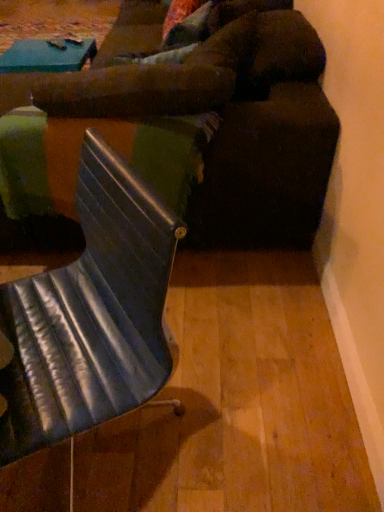
Question: Considering the relative sizes of metallic blue chair at center and metallic silver table at center in the image provided, is metallic blue chair at center bigger than metallic silver table at center?

Choices:
 (A) yes
 (B) no

Answer: (A)

Question: From the image's perspective, is metallic blue chair at center over metallic silver table at center?

Choices:
 (A) yes
 (B) no

Answer: (B)

Question: Does metallic blue chair at center appear on the left side of metallic silver table at center?

Choices:
 (A) no
 (B) yes

Answer: (A)

Question: From a real-world perspective, is metallic blue chair at center positioned over metallic silver table at center based on gravity?

Choices:
 (A) no
 (B) yes

Answer: (B)

Question: Does metallic blue chair at center have a lesser width compared to metallic silver table at center?

Choices:
 (A) no
 (B) yes

Answer: (B)

Question: From a real-world perspective, relative to metallic blue chair at center, is metallic silver table at center vertically above or below?

Choices:
 (A) below
 (B) above

Answer: (A)

Question: Is metallic silver table at center in front of or behind metallic blue chair at center in the image?

Choices:
 (A) front
 (B) behind

Answer: (B)

Question: Looking at the image, does metallic silver table at center seem bigger or smaller compared to metallic blue chair at center?

Choices:
 (A) big
 (B) small

Answer: (B)

Question: In the image, is metallic silver table at center on the left side or the right side of metallic blue chair at center?

Choices:
 (A) right
 (B) left

Answer: (B)

Question: Is velvet brown couch at center wider or thinner than metallic blue chair at center?

Choices:
 (A) wide
 (B) thin

Answer: (A)

Question: Considering the positions of velvet brown couch at center and metallic blue chair at center in the image, is velvet brown couch at center taller or shorter than metallic blue chair at center?

Choices:
 (A) short
 (B) tall

Answer: (B)

Question: Based on their sizes in the image, would you say velvet brown couch at center is bigger or smaller than metallic blue chair at center?

Choices:
 (A) small
 (B) big

Answer: (B)

Question: From a real-world perspective, is velvet brown couch at center above or below metallic blue chair at center?

Choices:
 (A) above
 (B) below

Answer: (A)

Question: Is point (89, 318) closer or farther from the camera than point (18, 197)?

Choices:
 (A) farther
 (B) closer

Answer: (B)

Question: Is metallic blue chair at center in front of or behind metallic silver table at center in the image?

Choices:
 (A) behind
 (B) front

Answer: (B)